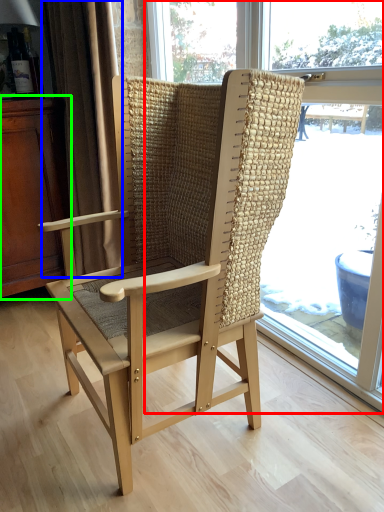
Question: Based on their relative distances, which object is farther from window (highlighted by a red box)? Choose from curtain (highlighted by a blue box) and dresser (highlighted by a green box).

Choices:
 (A) curtain
 (B) dresser

Answer: (B)